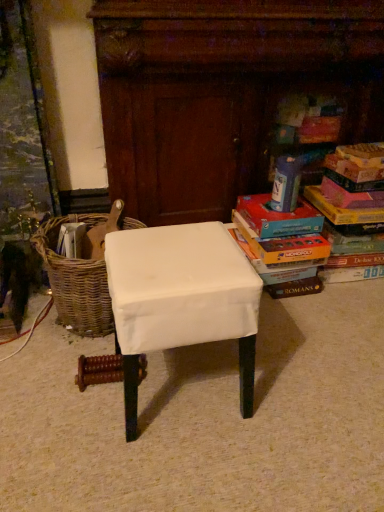
Question: Does matte cardboard book at right, the first book positioned from the left, come behind multicolored cardboard books at right, which ranks as the 2th book in left-to-right order?

Choices:
 (A) no
 (B) yes

Answer: (A)

Question: Is matte cardboard book at right, which ranks as the second book in right-to-left order, taller than multicolored cardboard books at right, which ranks as the 2th book in left-to-right order?

Choices:
 (A) no
 (B) yes

Answer: (A)

Question: Would you consider matte cardboard book at right, which ranks as the second book in right-to-left order, to be distant from multicolored cardboard books at right, which ranks as the 2th book in left-to-right order?

Choices:
 (A) no
 (B) yes

Answer: (A)

Question: Can you see matte cardboard book at right, which ranks as the second book in right-to-left order, touching multicolored cardboard books at right, which ranks as the 2th book in left-to-right order?

Choices:
 (A) yes
 (B) no

Answer: (B)

Question: Is matte cardboard book at right, the first book positioned from the left, smaller than multicolored cardboard books at right, which ranks as the 2th book in left-to-right order?

Choices:
 (A) yes
 (B) no

Answer: (A)

Question: Is matte cardboard book at right, the first book positioned from the left, in front of or behind hardcover book at upper right in the image?

Choices:
 (A) behind
 (B) front

Answer: (B)

Question: Would you say matte cardboard book at right, the first book positioned from the left, is inside or outside hardcover book at upper right?

Choices:
 (A) inside
 (B) outside

Answer: (B)

Question: Is point (286, 282) closer or farther from the camera than point (276, 166)?

Choices:
 (A) closer
 (B) farther

Answer: (A)

Question: From a real-world perspective, is matte cardboard book at right, the first book positioned from the left, physically located above or below hardcover book at upper right?

Choices:
 (A) above
 (B) below

Answer: (B)

Question: Is white fabric-covered stool at center situated inside multicolored cardboard books at right, the 1th book viewed from the right, or outside?

Choices:
 (A) inside
 (B) outside

Answer: (B)

Question: From the image's perspective, is white fabric-covered stool at center located above or below multicolored cardboard books at right, the 1th book viewed from the right?

Choices:
 (A) above
 (B) below

Answer: (B)

Question: Looking at their shapes, would you say white fabric-covered stool at center is wider or thinner than multicolored cardboard books at right, the 1th book viewed from the right?

Choices:
 (A) thin
 (B) wide

Answer: (A)

Question: Based on their positions, is white fabric-covered stool at center located to the left or right of multicolored cardboard books at right, the 1th book viewed from the right?

Choices:
 (A) right
 (B) left

Answer: (B)

Question: From a real-world perspective, is hardcover book at upper right positioned above or below woven brown basket at left?

Choices:
 (A) below
 (B) above

Answer: (B)

Question: From the image's perspective, is hardcover book at upper right located above or below woven brown basket at left?

Choices:
 (A) above
 (B) below

Answer: (A)